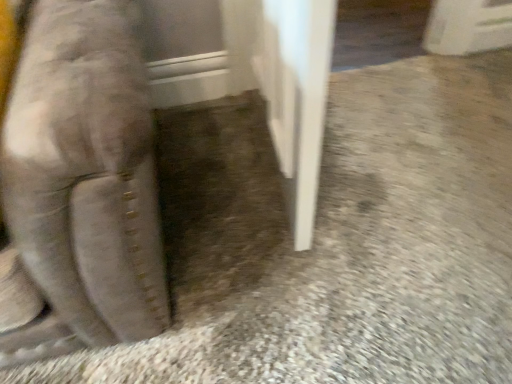
What is the approximate width of suede couch at left?

It is 28.91 centimeters.

What do you see at coordinates (83, 179) in the screenshot? This screenshot has width=512, height=384. I see `suede couch at left` at bounding box center [83, 179].

The width and height of the screenshot is (512, 384). What are the coordinates of `suede couch at left` in the screenshot? It's located at (83, 179).

In order to face suede couch at left, should I rotate leftwards or rightwards?

You should look left and rotate roughly 33.382 degrees.

Identify the location of suede couch at left. 83,179.